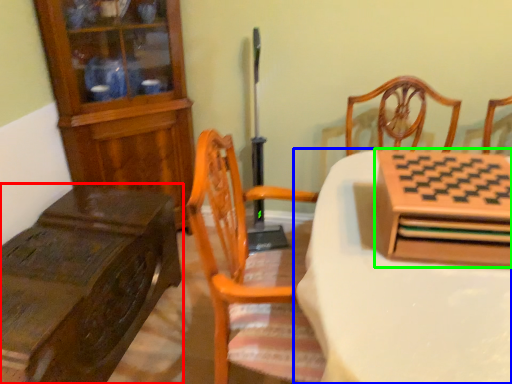
Question: Which object is positioned closest to table (highlighted by a red box)? Select from table (highlighted by a blue box) and cabinetry (highlighted by a green box).

Choices:
 (A) table
 (B) cabinetry

Answer: (A)